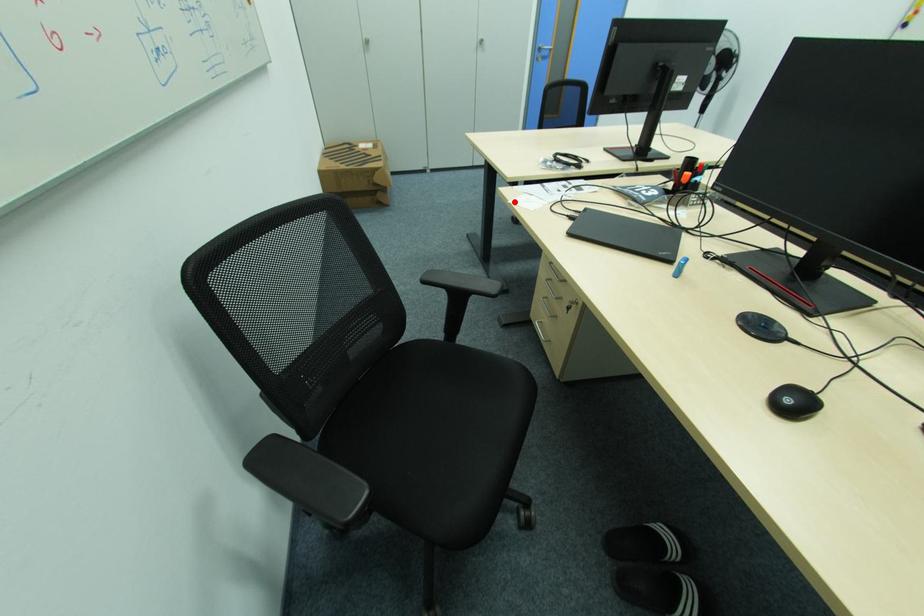
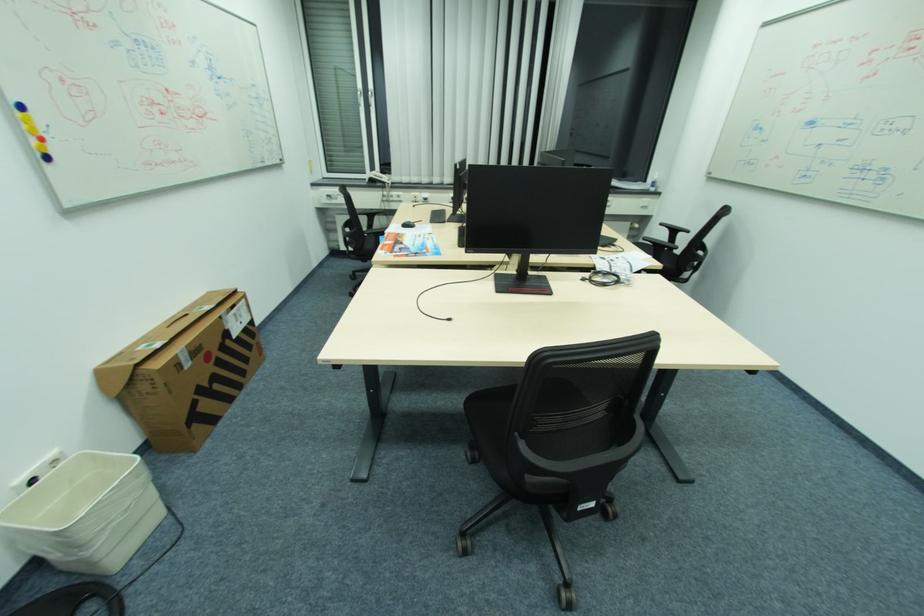
Question: I am providing you with two images of the same scene from different viewpoints. In image1, a red point is highlighted. Considering the same 3D point in image2, which of the following is correct?

Choices:
 (A) It is closer
 (B) It is farther

Answer: (B)